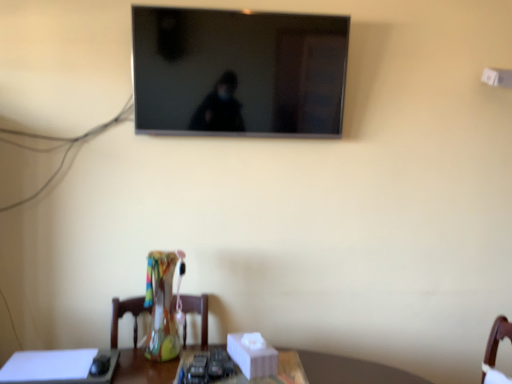
Question: Should I look upward or downward to see flat screen tv at upper center?

Choices:
 (A) up
 (B) down

Answer: (A)